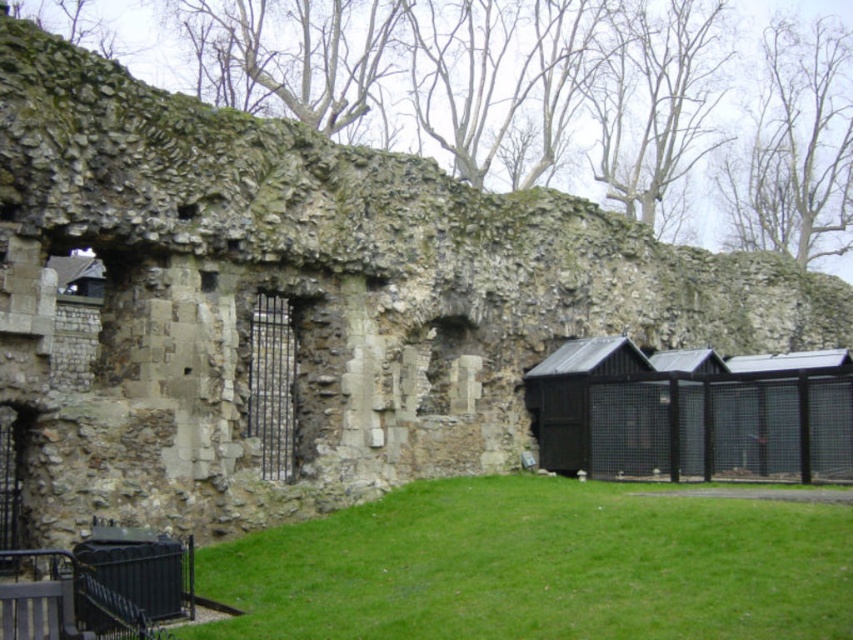
Question: Is green grass at lower center bigger than black metal hut at right?

Choices:
 (A) no
 (B) yes

Answer: (A)

Question: Which point is closer to the camera taking this photo?

Choices:
 (A) (689, 397)
 (B) (252, 548)

Answer: (B)

Question: Which point is closer to the camera?

Choices:
 (A) green grass at lower center
 (B) black metal hut at right

Answer: (A)

Question: Is green grass at lower center thinner than black metal hut at right?

Choices:
 (A) no
 (B) yes

Answer: (A)

Question: Is green grass at lower center below black metal hut at right?

Choices:
 (A) no
 (B) yes

Answer: (B)